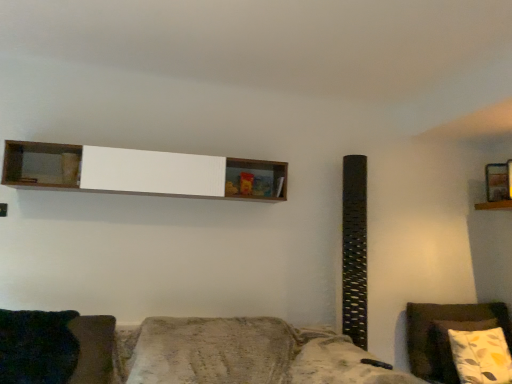
I want to click on white wood shelf at upper center, which appears as the second shelf when viewed from the right, so pos(141,172).

You are a GUI agent. You are given a task and a screenshot of the screen. Output one action in this format:
    pyautogui.click(x=<x>, y=<y>)
    Task: Click on the wooden shelf at upper right, which is counted as the 2th shelf, starting from the front
    The image size is (512, 384).
    Given the screenshot: What is the action you would take?
    pyautogui.click(x=497, y=187)

Is dark green fabric pillow at lower left surrounded by white wood shelf at upper center, which is the 1th shelf in front-to-back order?

That's incorrect, dark green fabric pillow at lower left is not inside white wood shelf at upper center, which is the 1th shelf in front-to-back order.

Can you see white wood shelf at upper center, which appears as the second shelf when viewed from the right, touching dark green fabric pillow at lower left?

No, white wood shelf at upper center, which appears as the second shelf when viewed from the right, is not with dark green fabric pillow at lower left.

Does point (170, 162) come closer to viewer compared to point (17, 348)?

That is False.

Does white wood shelf at upper center, the 2th shelf in the back-to-front sequence, come in front of dark green fabric pillow at lower left?

That is False.

Does dark green fabric pillow at lower left appear on the right side of white wood shelf at upper center, which appears as the second shelf when viewed from the right?

Incorrect, dark green fabric pillow at lower left is not on the right side of white wood shelf at upper center, which appears as the second shelf when viewed from the right.

Choose the correct answer: Is dark green fabric pillow at lower left inside white wood shelf at upper center, which ranks as the 1th shelf in left-to-right order, or outside it?

The correct answer is: outside.

Are dark green fabric pillow at lower left and white wood shelf at upper center, which ranks as the 1th shelf in left-to-right order, beside each other?

dark green fabric pillow at lower left and white wood shelf at upper center, which ranks as the 1th shelf in left-to-right order, are not in contact.

Between dark green fabric pillow at lower left and white wood shelf at upper center, which appears as the second shelf when viewed from the right, which one has larger size?

Bigger between the two is white wood shelf at upper center, which appears as the second shelf when viewed from the right.

Is there a large distance between wooden shelf at upper right, the 2th shelf viewed from the left, and floral pillow at right?

Yes, wooden shelf at upper right, the 2th shelf viewed from the left, and floral pillow at right are quite far apart.

Does point (486, 179) come behind point (407, 309)?

That is True.

From a real-world perspective, which object rests below the other?

In real-world perspective, floral pillow at right is lower.

Does wooden shelf at upper right, acting as the 1th shelf starting from the right, turn towards dark green fabric pillow at lower left?

No, wooden shelf at upper right, acting as the 1th shelf starting from the right, does not turn towards dark green fabric pillow at lower left.

Is wooden shelf at upper right, the 2th shelf viewed from the left, to the right of dark green fabric pillow at lower left from the viewer's perspective?

Indeed, wooden shelf at upper right, the 2th shelf viewed from the left, is positioned on the right side of dark green fabric pillow at lower left.

This screenshot has width=512, height=384. Find the location of `pillow below the wooden shelf at upper right, acting as the 1th shelf starting from the right (from the image's perspective)`. pillow below the wooden shelf at upper right, acting as the 1th shelf starting from the right (from the image's perspective) is located at coordinates (37, 347).

Looking at this image, considering the sizes of objects dark green fabric pillow at lower left and textured brown fabric couch at lower center in the image provided, who is taller, dark green fabric pillow at lower left or textured brown fabric couch at lower center?

Standing taller between the two is textured brown fabric couch at lower center.

Is dark green fabric pillow at lower left closer to the viewer compared to textured brown fabric couch at lower center?

No, it is behind textured brown fabric couch at lower center.

In terms of size, does dark green fabric pillow at lower left appear bigger or smaller than textured brown fabric couch at lower center?

Clearly, dark green fabric pillow at lower left is smaller in size than textured brown fabric couch at lower center.

Is white wood shelf at upper center, the 2th shelf in the back-to-front sequence, bigger or smaller than floral pillow at right?

In the image, white wood shelf at upper center, the 2th shelf in the back-to-front sequence, appears to be larger than floral pillow at right.

Does white wood shelf at upper center, which appears as the second shelf when viewed from the right, appear on the left side of floral pillow at right?

Indeed, white wood shelf at upper center, which appears as the second shelf when viewed from the right, is positioned on the left side of floral pillow at right.

Which object is thinner, white wood shelf at upper center, the 2th shelf in the back-to-front sequence, or floral pillow at right?

floral pillow at right is thinner.

Does white wood shelf at upper center, which is the 1th shelf in front-to-back order, come in front of floral pillow at right?

Yes.

How many degrees apart are the facing directions of floral pillow at right and wooden shelf at upper right, which is counted as the 2th shelf, starting from the front?

13.1 degrees separate the facing orientations of floral pillow at right and wooden shelf at upper right, which is counted as the 2th shelf, starting from the front.

Which is behind, point (438, 305) or point (488, 176)?

The point (488, 176) is farther.

Which object is closer to the camera taking this photo, floral pillow at right or wooden shelf at upper right, acting as the 1th shelf starting from the right?

floral pillow at right is closer to the camera.

Consider the image. Considering the sizes of objects floral pillow at right and wooden shelf at upper right, marked as the 1th shelf in a back-to-front arrangement, in the image provided, who is wider, floral pillow at right or wooden shelf at upper right, marked as the 1th shelf in a back-to-front arrangement,?

With larger width is floral pillow at right.

Locate an element on the screen. The height and width of the screenshot is (384, 512). pillow below the white wood shelf at upper center, the 2th shelf in the back-to-front sequence (from the image's perspective) is located at coordinates (37, 347).

The image size is (512, 384). I want to click on pillow below the white wood shelf at upper center, which ranks as the 1th shelf in left-to-right order (from a real-world perspective), so click(x=37, y=347).

Considering their positions, is textured brown fabric couch at lower center positioned closer to white wood shelf at upper center, the 2th shelf in the back-to-front sequence, than wooden shelf at upper right, which is counted as the 2th shelf, starting from the front?

The object closer to white wood shelf at upper center, the 2th shelf in the back-to-front sequence, is textured brown fabric couch at lower center.

When comparing their distances from textured brown fabric couch at lower center, does dark green fabric pillow at lower left or white wood shelf at upper center, which appears as the second shelf when viewed from the right, seem closer?

Based on the image, dark green fabric pillow at lower left appears to be nearer to textured brown fabric couch at lower center.

Based on their spatial positions, is white wood shelf at upper center, which is the 1th shelf in front-to-back order, or wooden shelf at upper right, marked as the 1th shelf in a back-to-front arrangement, further from textured brown fabric couch at lower center?

The object further to textured brown fabric couch at lower center is wooden shelf at upper right, marked as the 1th shelf in a back-to-front arrangement.

Looking at the image, which one is located further to white wood shelf at upper center, the 2th shelf in the back-to-front sequence, dark green fabric pillow at lower left or wooden shelf at upper right, which is counted as the 2th shelf, starting from the front?

Based on the image, wooden shelf at upper right, which is counted as the 2th shelf, starting from the front, appears to be further to white wood shelf at upper center, the 2th shelf in the back-to-front sequence.

Looking at the image, which one is located closer to floral pillow at right, wooden shelf at upper right, the 2th shelf viewed from the left, or textured brown fabric couch at lower center?

wooden shelf at upper right, the 2th shelf viewed from the left, is closer to floral pillow at right.

Considering their positions, is floral pillow at right positioned closer to textured brown fabric couch at lower center than white wood shelf at upper center, the 2th shelf in the back-to-front sequence?

white wood shelf at upper center, the 2th shelf in the back-to-front sequence.

In the scene shown: Based on their spatial positions, is wooden shelf at upper right, which is counted as the 2th shelf, starting from the front, or dark green fabric pillow at lower left closer to textured brown fabric couch at lower center?

Based on the image, dark green fabric pillow at lower left appears to be nearer to textured brown fabric couch at lower center.

Which object lies nearer to the anchor point floral pillow at right, textured brown fabric couch at lower center or white wood shelf at upper center, which is the 1th shelf in front-to-back order?

Among the two, textured brown fabric couch at lower center is located nearer to floral pillow at right.

Locate an element on the screen. This screenshot has width=512, height=384. pillow between white wood shelf at upper center, the 2th shelf in the back-to-front sequence, and textured brown fabric couch at lower center vertically is located at coordinates (37, 347).

The width and height of the screenshot is (512, 384). I want to click on shelf between dark green fabric pillow at lower left and wooden shelf at upper right, marked as the 1th shelf in a back-to-front arrangement, so click(x=141, y=172).

Find the location of a particular element. studio couch between dark green fabric pillow at lower left and wooden shelf at upper right, marked as the 1th shelf in a back-to-front arrangement is located at coordinates (249, 354).

This screenshot has width=512, height=384. What are the coordinates of `studio couch between white wood shelf at upper center, which is the 1th shelf in front-to-back order, and floral pillow at right, in the horizontal direction` in the screenshot? It's located at (249, 354).